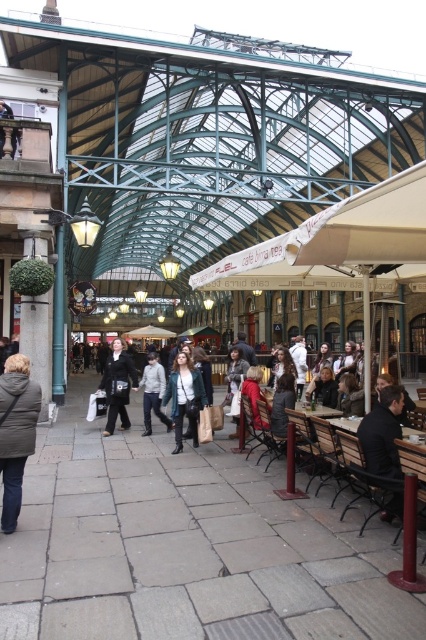
You are shopping in the market and see two jackets hanging at the center of the store. The denim jacket at center and the light gray jacket at center. Which jacket is taller?

The denim jacket at center is taller than the light gray jacket at center.

You are standing in the market and see two jackets hanging at the center of the stall. Which jacket is nearer to you, the denim jacket at center or the light gray jacket at center?

The denim jacket at center is closer to the viewer than the light gray jacket at center, so the denim jacket at center is nearer to you.

You are a delivery person carrying a box that is 3 feet wide. You need to move through the space between the dark brown leather jacket at center and the light gray jacket at center in the market. Can your box fit through the space between them?

The distance between the dark brown leather jacket at center and the light gray jacket at center is 3.55 feet. Since the box is 3 feet wide, it can fit through the space between them as the available space is wider than the box.